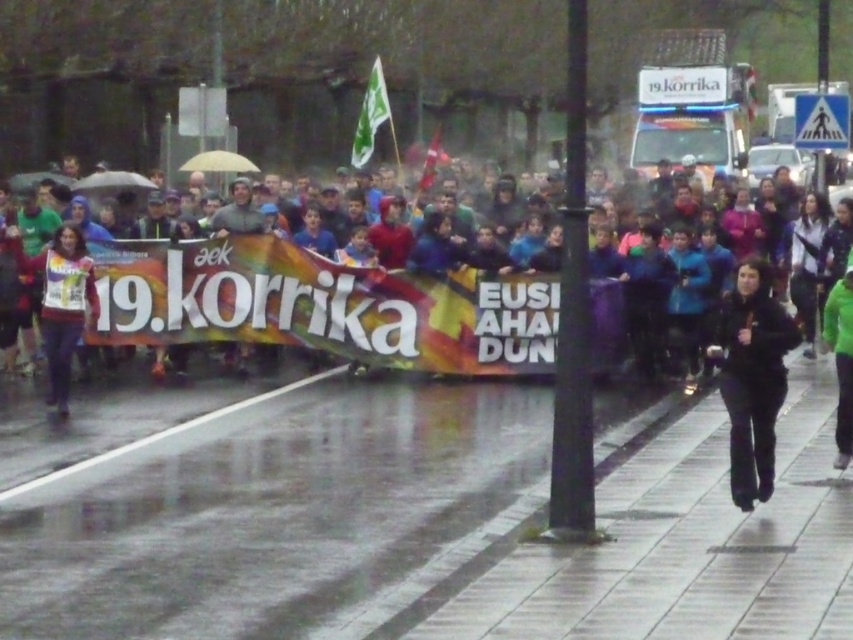
Question: Which of the following is the closest to the observer?

Choices:
 (A) (839, 397)
 (B) (747, 396)

Answer: (B)

Question: Does black matte pants at lower right have a larger size compared to green matte jacket at lower right?

Choices:
 (A) no
 (B) yes

Answer: (B)

Question: Which of the following is the farthest from the observer?

Choices:
 (A) (786, 323)
 (B) (90, 273)

Answer: (B)

Question: Which point is closer to the camera?

Choices:
 (A) green matte jacket at lower right
 (B) black matte pants at lower right

Answer: (B)

Question: Does black matte pants at lower right appear on the left side of green matte jacket at lower right?

Choices:
 (A) no
 (B) yes

Answer: (B)

Question: Observing the image, what is the correct spatial positioning of black matte pants at lower right in reference to matte white shirt at left?

Choices:
 (A) below
 (B) above

Answer: (A)